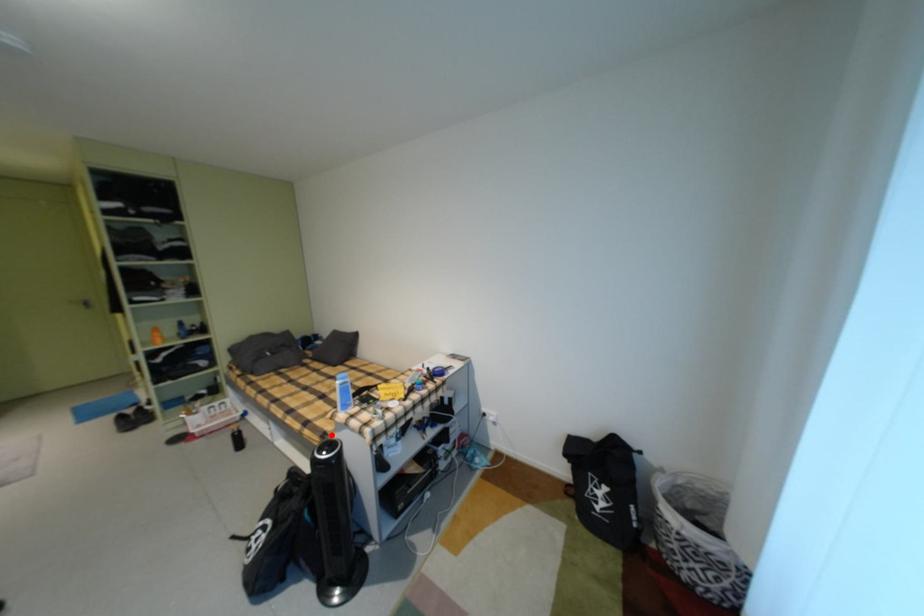
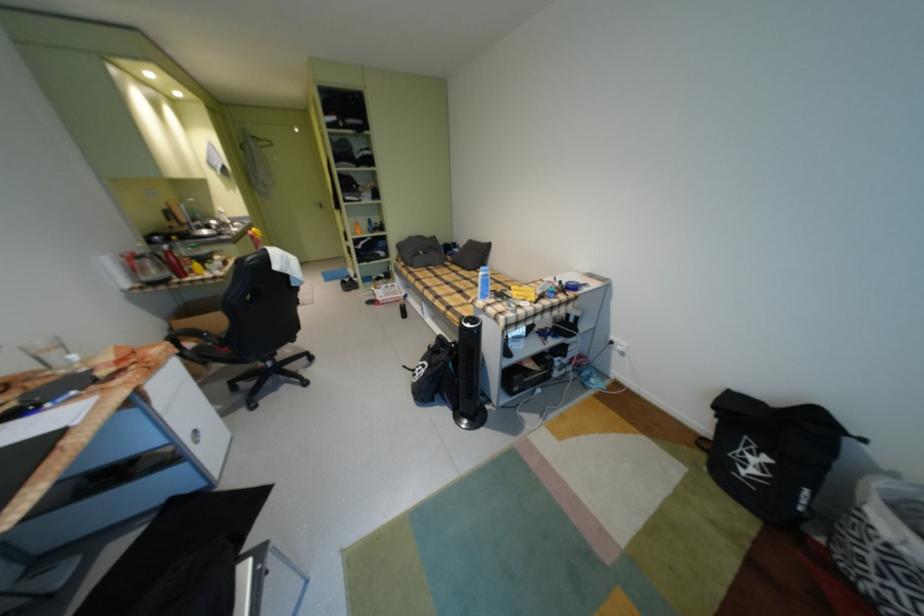
Locate, in the second image, the point that corresponds to the highlighted location in the first image.

(470, 318)